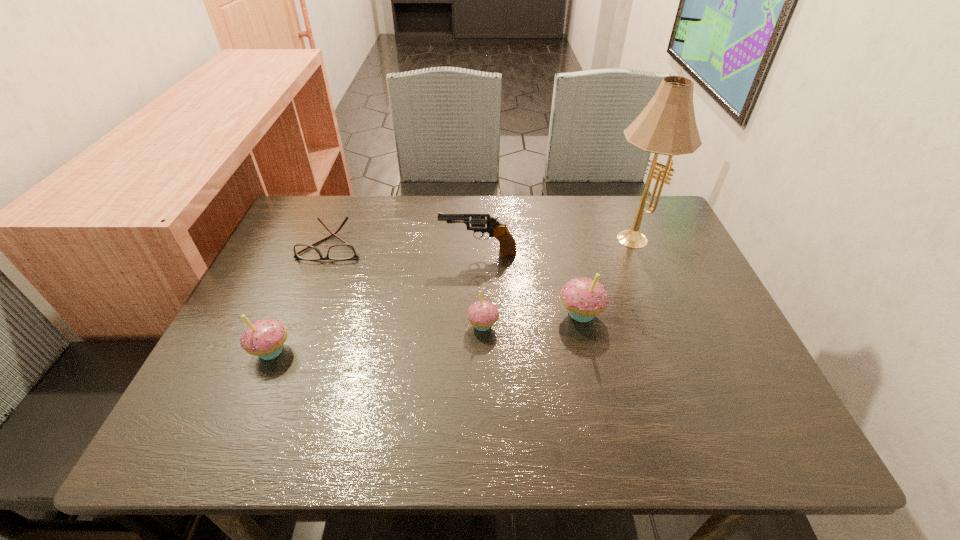
The width and height of the screenshot is (960, 540). Find the location of `free space between the gun and the shortest object`. free space between the gun and the shortest object is located at coordinates (405, 248).

Find the location of a particular element. free area in between the gun and the tallest cupcake is located at coordinates (529, 282).

Identify which object is the third closest to the rightmost cupcake. Please provide its 2D coordinates. Your answer should be formatted as a tuple, i.e. [(x, y)], where the tuple contains the x and y coordinates of a point satisfying the conditions above.

[(480, 222)]

You are a GUI agent. You are given a task and a screenshot of the screen. Output one action in this format:
    pyautogui.click(x=<x>, y=<y>)
    Task: Click on the object that stands as the fourth closest to the second object from right to left
    
    Given the screenshot: What is the action you would take?
    pyautogui.click(x=344, y=251)

Find the location of a particular element. The width and height of the screenshot is (960, 540). cupcake that stands as the second closest to the shortest cupcake is located at coordinates (264, 338).

Locate which cupcake is the second closest to the second shortest object. Please provide its 2D coordinates. Your answer should be formatted as a tuple, i.e. [(x, y)], where the tuple contains the x and y coordinates of a point satisfying the conditions above.

[(264, 338)]

You are a GUI agent. You are given a task and a screenshot of the screen. Output one action in this format:
    pyautogui.click(x=<x>, y=<y>)
    Task: Click on the vacant space that satisfies the following two spatial constraints: 1. on the back side of the second tallest cupcake; 2. along the barrel of the gun
    
    Given the screenshot: What is the action you would take?
    pyautogui.click(x=314, y=252)

Identify the location of free point that satisfies the following two spatial constraints: 1. on the front-facing side of the shortest object; 2. along the barrel of the gun. (329, 252).

I want to click on vacant space that satisfies the following two spatial constraints: 1. on the back side of the second tallest cupcake; 2. along the barrel of the gun, so click(314, 252).